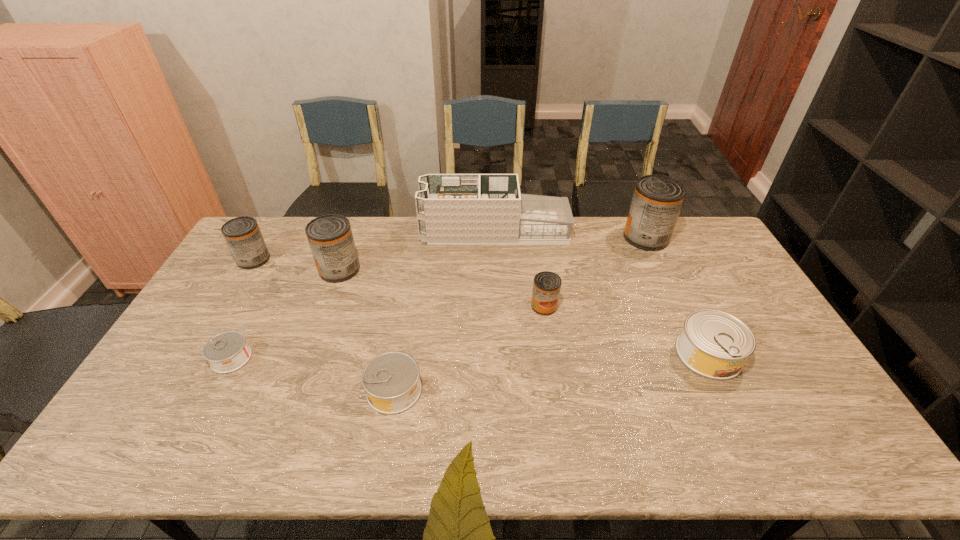
Where is `free space between the shortest can and the fourth can from left to right`? This screenshot has height=540, width=960. free space between the shortest can and the fourth can from left to right is located at coordinates (313, 374).

The width and height of the screenshot is (960, 540). Identify the location of free space between the fourth can from left to right and the nearest red can. (469, 348).

The image size is (960, 540). I want to click on free spot between the smallest red can and the dollhouse, so click(519, 268).

Identify which object is the nearest to the leftmost red can. Please provide its 2D coordinates. Your answer should be formatted as a tuple, i.e. [(x, y)], where the tuple contains the x and y coordinates of a point satisfying the conditions above.

[(330, 237)]

You are a GUI agent. You are given a task and a screenshot of the screen. Output one action in this format:
    pyautogui.click(x=<x>, y=<y>)
    Task: Click on the object that is the fifth nearest to the dollhouse
    The image size is (960, 540).
    Given the screenshot: What is the action you would take?
    pyautogui.click(x=242, y=234)

Select which can is the second closest to the third red can from right to left. Please provide its 2D coordinates. Your answer should be formatted as a tuple, i.e. [(x, y)], where the tuple contains the x and y coordinates of a point satisfying the conditions above.

[(226, 352)]

Locate which can ranks in proximity to the second smallest silver can. Please provide its 2D coordinates. Your answer should be formatted as a tuple, i.e. [(x, y)], where the tuple contains the x and y coordinates of a point satisfying the conditions above.

[(226, 352)]

Locate which red can is the third closest to the rightmost red can. Please provide its 2D coordinates. Your answer should be formatted as a tuple, i.e. [(x, y)], where the tuple contains the x and y coordinates of a point satisfying the conditions above.

[(242, 234)]

At what (x,y) coordinates should I click in order to perform the action: click on red can that is the third closest to the second red can from right to left. Please return your answer as a coordinate pair (x, y). The width and height of the screenshot is (960, 540). Looking at the image, I should click on (242, 234).

Where is `the second closest silver can to the second biggest red can`? the second closest silver can to the second biggest red can is located at coordinates (391, 380).